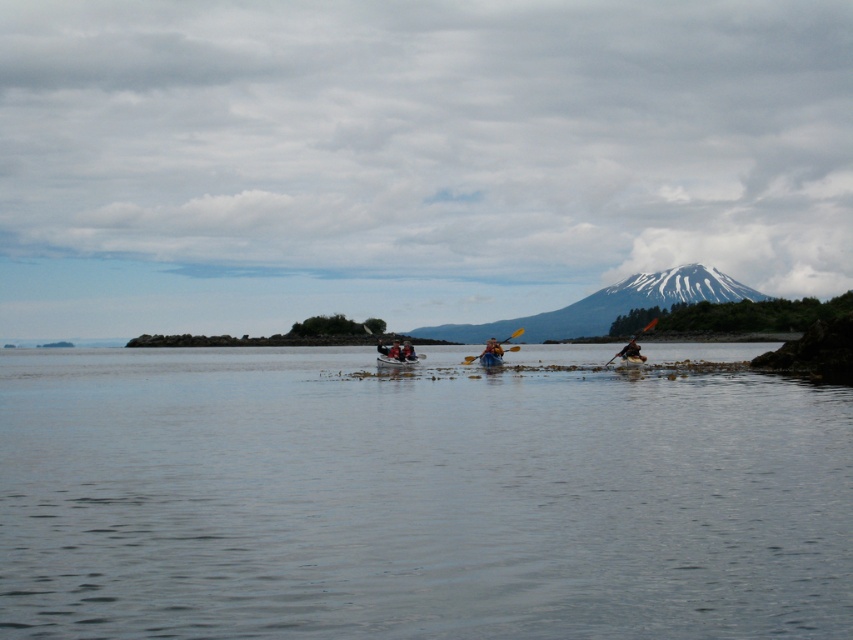
Question: Which object is positioned farthest from the clear water at center?

Choices:
 (A) wooden paddle at center
 (B) white snow-covered mountain at upper center
 (C) yellow plastic kayak at center

Answer: (B)

Question: Among these objects, which one is nearest to the camera?

Choices:
 (A) matte blue canoe at center
 (B) clear water at center
 (C) blue plastic paddle at center
 (D) yellow plastic kayak at center

Answer: (B)

Question: Does white snow-covered mountain at upper center appear under matte blue kayak at center?

Choices:
 (A) yes
 (B) no

Answer: (B)

Question: Which of these objects is positioned closest to the yellow plastic kayak at center?

Choices:
 (A) clear water at center
 (B) blue plastic canoe at center

Answer: (B)

Question: Does blue plastic canoe at center appear over blue plastic paddle at center?

Choices:
 (A) yes
 (B) no

Answer: (B)

Question: Does matte blue canoe at center appear under matte blue kayak at center?

Choices:
 (A) yes
 (B) no

Answer: (A)